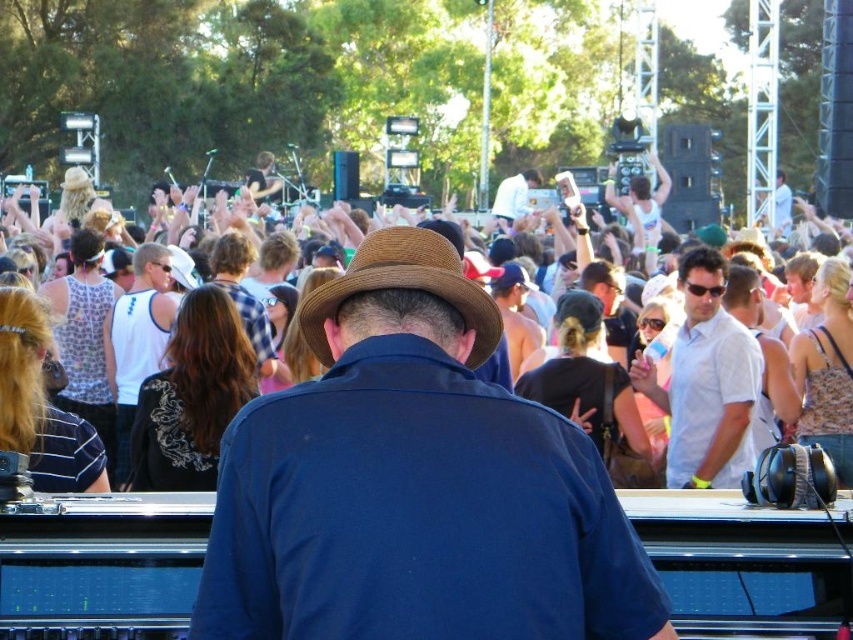
Between matte brown hat at center and white cotton shirt at center, which one has less height?

white cotton shirt at center is shorter.

Which is below, matte brown hat at center or white cotton shirt at center?

matte brown hat at center is lower down.

You are a GUI agent. You are given a task and a screenshot of the screen. Output one action in this format:
    pyautogui.click(x=<x>, y=<y>)
    Task: Click on the matte brown hat at center
    The width and height of the screenshot is (853, 640).
    Given the screenshot: What is the action you would take?
    tap(415, 483)

Can you confirm if white cotton shirt at center is wider than brown felt fedora at center?

No.

Does white cotton shirt at center lie behind brown felt fedora at center?

That is True.

Between point (746, 326) and point (364, 264), which one is positioned behind?

The point (746, 326) is more distant.

Find the location of a particular element. white cotton shirt at center is located at coordinates (706, 381).

Who is lower down, matte brown hat at center or brown felt fedora at center?

Positioned lower is matte brown hat at center.

The height and width of the screenshot is (640, 853). I want to click on matte brown hat at center, so click(415, 483).

Locate an element on the screen. The image size is (853, 640). matte brown hat at center is located at coordinates (415, 483).